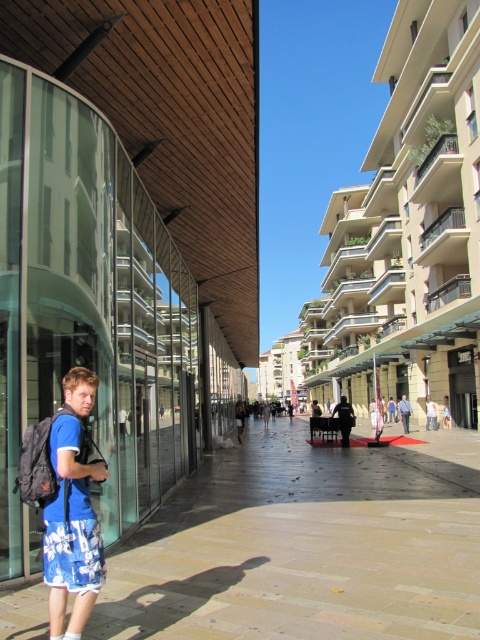
Question: Based on their relative distances, which object is farther from the blue fabric shirt at center?

Choices:
 (A) dark gray fabric jacket at center
 (B) brown stone pavement at lower center
 (C) blue printed shorts at lower left

Answer: (C)

Question: Which is farther from the dark gray fabric jacket at center?

Choices:
 (A) blue fabric shirt at center
 (B) blue fabric shorts at lower left
 (C) blue printed shorts at lower left
 (D) brown stone pavement at lower center

Answer: (C)

Question: Which object appears farthest from the camera in this image?

Choices:
 (A) blue fabric shirt at center
 (B) blue printed shorts at lower left

Answer: (A)

Question: Is blue fabric shirt at center wider than blue fabric shorts at lower left?

Choices:
 (A) no
 (B) yes

Answer: (B)

Question: Observing the image, what is the correct spatial positioning of blue printed shorts at lower left in reference to blue fabric shorts at lower left?

Choices:
 (A) left
 (B) right

Answer: (A)

Question: Is dark gray fabric jacket at center to the right of blue fabric shorts at lower left from the viewer's perspective?

Choices:
 (A) yes
 (B) no

Answer: (B)